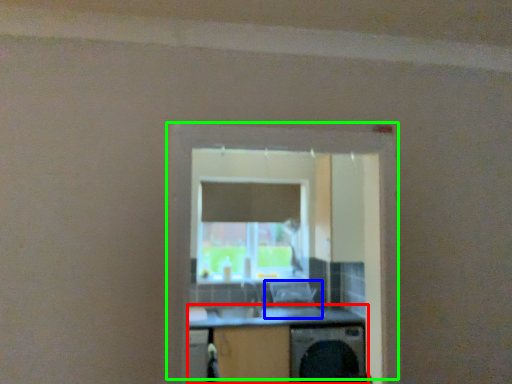
Question: Based on their relative distances, which object is nearer to computer desk (highlighted by a red box)? Choose from computer chair (highlighted by a blue box) and window (highlighted by a green box).

Choices:
 (A) computer chair
 (B) window

Answer: (A)